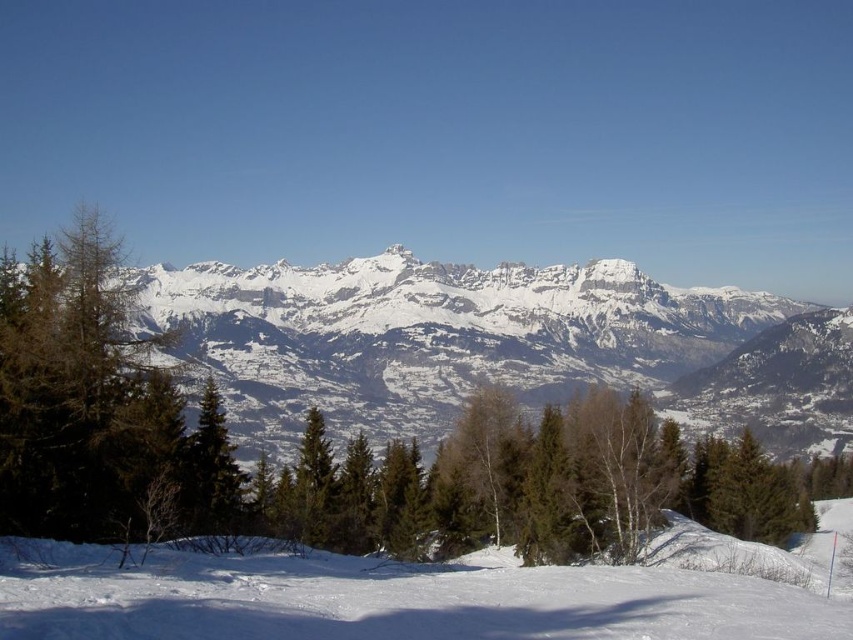
Question: Which of these objects is positioned farthest from the white snow-covered mountain range at center?

Choices:
 (A) green matte tree at center
 (B) white powdery snow at lower center

Answer: (B)

Question: Is white snow-covered mountain range at center bigger than white powdery snow at lower center?

Choices:
 (A) yes
 (B) no

Answer: (A)

Question: Is white powdery snow at lower center in front of green matte tree at center?

Choices:
 (A) no
 (B) yes

Answer: (B)

Question: Does white powdery snow at lower center lie in front of green matte tree at center?

Choices:
 (A) no
 (B) yes

Answer: (B)

Question: Which of these objects is positioned farthest from the white powdery snow at lower center?

Choices:
 (A) white snow-covered mountain range at center
 (B) green matte tree at center

Answer: (A)

Question: Which point is farther from the camera taking this photo?

Choices:
 (A) (192, 524)
 (B) (393, 424)

Answer: (B)